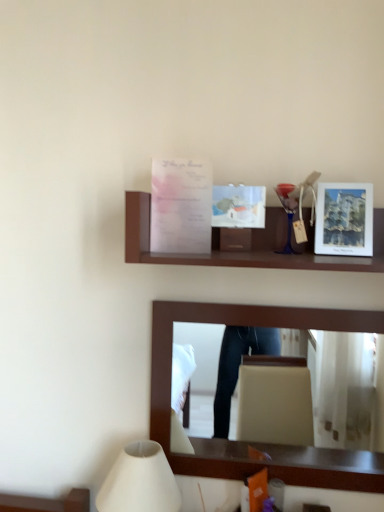
In order to click on brown wooden mirror at upper center in this screenshot , I will do `click(246, 442)`.

The width and height of the screenshot is (384, 512). What do you see at coordinates (250, 246) in the screenshot?
I see `wooden shelf at center` at bounding box center [250, 246].

Measure the distance between white matte lampshade at lower left and camera.

white matte lampshade at lower left and camera are 1.04 meters apart from each other.

Find the location of `white matte lampshade at lower left`. white matte lampshade at lower left is located at coordinates (140, 481).

I want to click on matte white picture frame at right, so click(x=344, y=219).

This screenshot has height=512, width=384. I want to click on translucent paper postcard at upper center, so click(181, 206).

The height and width of the screenshot is (512, 384). I want to click on brown wooden mirror at upper center, so click(246, 442).

Based on the photo, is brown wooden mirror at upper center a part of matte white picture frame at right?

No, brown wooden mirror at upper center is not a part of matte white picture frame at right.

From the image's perspective, who appears lower, matte white picture frame at right or brown wooden mirror at upper center?

brown wooden mirror at upper center, from the image's perspective.

Is matte white picture frame at right behind brown wooden mirror at upper center?

No, matte white picture frame at right is in front of brown wooden mirror at upper center.

Is point (167, 316) closer or farther from the camera than point (321, 241)?

Point (167, 316) is positioned farther from the camera compared to point (321, 241).

Looking at this image, between brown wooden mirror at upper center and matte white picture frame at right, which one has less height?

Standing shorter between the two is matte white picture frame at right.

Can you confirm if brown wooden mirror at upper center is bigger than matte white picture frame at right?

Yes.

Considering the relative sizes of translucent paper postcard at upper center and brown wooden mirror at upper center in the image provided, is translucent paper postcard at upper center smaller than brown wooden mirror at upper center?

Yes, translucent paper postcard at upper center is smaller than brown wooden mirror at upper center.

From a real-world perspective, is translucent paper postcard at upper center physically above brown wooden mirror at upper center?

Yes, from a real-world perspective, translucent paper postcard at upper center is over brown wooden mirror at upper center

Is translucent paper postcard at upper center beside brown wooden mirror at upper center?

No.

How far apart are white matte lampshade at lower left and wooden shelf at center?

23.36 inches.

Where is `table lamp that is on the left side of wooden shelf at center`? Image resolution: width=384 pixels, height=512 pixels. table lamp that is on the left side of wooden shelf at center is located at coordinates (140, 481).

In terms of size, does white matte lampshade at lower left appear bigger or smaller than wooden shelf at center?

white matte lampshade at lower left is smaller than wooden shelf at center.

Between white matte lampshade at lower left and wooden shelf at center, which one has larger width?

With larger width is wooden shelf at center.

Is brown wooden mirror at upper center positioned behind white matte lampshade at lower left?

Yes, brown wooden mirror at upper center is behind white matte lampshade at lower left.

Is brown wooden mirror at upper center taller or shorter than white matte lampshade at lower left?

Clearly, brown wooden mirror at upper center is taller compared to white matte lampshade at lower left.

Would you say brown wooden mirror at upper center is inside or outside white matte lampshade at lower left?

brown wooden mirror at upper center cannot be found inside white matte lampshade at lower left.

Can you confirm if brown wooden mirror at upper center is positioned to the right of white matte lampshade at lower left?

Indeed, brown wooden mirror at upper center is positioned on the right side of white matte lampshade at lower left.

Between translucent paper postcard at upper center and matte white picture frame at right, which one has smaller width?

translucent paper postcard at upper center.

Is translucent paper postcard at upper center facing away from matte white picture frame at right?

That's not correct — translucent paper postcard at upper center is not looking away from matte white picture frame at right.

Considering the sizes of objects translucent paper postcard at upper center and matte white picture frame at right in the image provided, who is bigger, translucent paper postcard at upper center or matte white picture frame at right?

Bigger between the two is translucent paper postcard at upper center.

The height and width of the screenshot is (512, 384). What are the coordinates of `shelf that appears above the brown wooden mirror at upper center (from a real-world perspective)` in the screenshot? It's located at (250, 246).

Is wooden shelf at center oriented towards brown wooden mirror at upper center?

No, wooden shelf at center is not aimed at brown wooden mirror at upper center.

Is wooden shelf at center taller than brown wooden mirror at upper center?

No, wooden shelf at center is not taller than brown wooden mirror at upper center.

Is wooden shelf at center surrounding brown wooden mirror at upper center?

No, wooden shelf at center does not contain brown wooden mirror at upper center.

The height and width of the screenshot is (512, 384). Find the location of `mirror below the matte white picture frame at right (from a real-world perspective)`. mirror below the matte white picture frame at right (from a real-world perspective) is located at coordinates (246, 442).

The height and width of the screenshot is (512, 384). I want to click on mirror behind the matte white picture frame at right, so click(x=246, y=442).

When comparing their distances from brown wooden mirror at upper center, does translucent paper postcard at upper center or matte white picture frame at right seem further?

The object further to brown wooden mirror at upper center is matte white picture frame at right.

In the scene shown: When comparing their distances from wooden shelf at center, does translucent paper postcard at upper center or matte white picture frame at right seem closer?

translucent paper postcard at upper center is closer to wooden shelf at center.

Considering their positions, is wooden shelf at center positioned further to brown wooden mirror at upper center than white matte lampshade at lower left?

Based on the image, wooden shelf at center appears to be further to brown wooden mirror at upper center.

Based on their spatial positions, is wooden shelf at center or brown wooden mirror at upper center closer to white matte lampshade at lower left?

brown wooden mirror at upper center is closer to white matte lampshade at lower left.

Estimate the real-world distances between objects in this image. Which object is further from white matte lampshade at lower left, translucent paper postcard at upper center or wooden shelf at center?

translucent paper postcard at upper center is further to white matte lampshade at lower left.

Based on their spatial positions, is matte white picture frame at right or translucent paper postcard at upper center closer to brown wooden mirror at upper center?

translucent paper postcard at upper center lies closer to brown wooden mirror at upper center than the other object.

Based on their spatial positions, is white matte lampshade at lower left or translucent paper postcard at upper center further from matte white picture frame at right?

white matte lampshade at lower left is further to matte white picture frame at right.

Based on their spatial positions, is wooden shelf at center or brown wooden mirror at upper center closer to translucent paper postcard at upper center?

wooden shelf at center is closer to translucent paper postcard at upper center.

Image resolution: width=384 pixels, height=512 pixels. Identify the location of shelf between translucent paper postcard at upper center and brown wooden mirror at upper center vertically. (250, 246).

The width and height of the screenshot is (384, 512). I want to click on picture frame between translucent paper postcard at upper center and brown wooden mirror at upper center in the up-down direction, so click(x=344, y=219).

Find the location of `picture frame between translucent paper postcard at upper center and white matte lampshade at lower left vertically`. picture frame between translucent paper postcard at upper center and white matte lampshade at lower left vertically is located at coordinates (344, 219).

Locate an element on the screen. shelf between translucent paper postcard at upper center and white matte lampshade at lower left from top to bottom is located at coordinates 250,246.